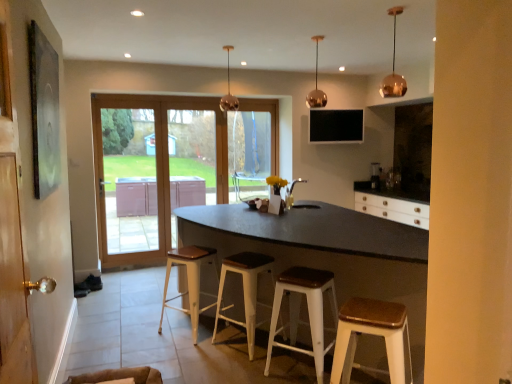
Find the location of a particular element. This screenshot has height=384, width=512. white wood stool at lower right, placed as the 1th stool when sorted from front to back is located at coordinates point(373,335).

Locate an element on the screen. The width and height of the screenshot is (512, 384). white metal stool at center, acting as the 2th stool starting from the front is located at coordinates (298, 311).

What do you see at coordinates (229, 91) in the screenshot?
I see `metallic gold pendant light at upper center, marked as the third light fixture in a right-to-left arrangement` at bounding box center [229, 91].

The height and width of the screenshot is (384, 512). Find the location of `matte silver sink at center`. matte silver sink at center is located at coordinates (293, 197).

What do you see at coordinates (326, 251) in the screenshot?
I see `black matte table at center` at bounding box center [326, 251].

In order to click on white wood stool at lower right, which ranks as the fourth stool in back-to-front order in this screenshot , I will do `click(373, 335)`.

Considering the points (375, 313) and (388, 10), which point is behind, point (375, 313) or point (388, 10)?

Positioned behind is point (388, 10).

From a real-world perspective, relative to copper metallic pendant light at upper right, marked as the 3th light fixture in a left-to-right arrangement, is white wood stool at lower right, which ranks as the fourth stool in back-to-front order, vertically above or below?

white wood stool at lower right, which ranks as the fourth stool in back-to-front order, is situated lower than copper metallic pendant light at upper right, marked as the 3th light fixture in a left-to-right arrangement, in the real world.

Which object is more forward, white wood stool at lower right, which ranks as the fourth stool in back-to-front order, or copper metallic pendant light at upper right, which appears as the 1th light fixture when viewed from the front?

white wood stool at lower right, which ranks as the fourth stool in back-to-front order, is more forward.

In the image, is white wood stool at lower right, which ranks as the fourth stool in back-to-front order, on the left side or the right side of copper metallic pendant light at upper right, marked as the 3th light fixture in a left-to-right arrangement?

In the image, white wood stool at lower right, which ranks as the fourth stool in back-to-front order, appears on the left side of copper metallic pendant light at upper right, marked as the 3th light fixture in a left-to-right arrangement.

Which of these two, transparent glass window at center or metallic silver blender at center, is thinner?

transparent glass window at center is thinner.

Is there a large distance between transparent glass window at center and metallic silver blender at center?

Yes, transparent glass window at center and metallic silver blender at center are quite far apart.

Is white wood stool at center, placed as the first stool when sorted from back to front, next to white metal stool at center, acting as the 2th stool starting from the front, and touching it?

white wood stool at center, placed as the first stool when sorted from back to front, and white metal stool at center, acting as the 2th stool starting from the front, are not in contact.

Considering the sizes of objects white wood stool at center, placed as the fourth stool when sorted from front to back, and white metal stool at center, the 3th stool from the back, in the image provided, who is taller, white wood stool at center, placed as the fourth stool when sorted from front to back, or white metal stool at center, the 3th stool from the back,?

Standing taller between the two is white wood stool at center, placed as the fourth stool when sorted from front to back.

Would you say white wood stool at center, placed as the first stool when sorted from back to front, contains white metal stool at center, acting as the 2th stool starting from the front?

No, white metal stool at center, acting as the 2th stool starting from the front, is not surrounded by white wood stool at center, placed as the first stool when sorted from back to front.

Between white wood stool at center, placed as the fourth stool when sorted from front to back, and white metal stool at center, the 3th stool from the back, which one has larger width?

Wider between the two is white wood stool at center, placed as the fourth stool when sorted from front to back.

Considering the sizes of objects metallic silver blender at center and transparent glass window at center in the image provided, who is shorter, metallic silver blender at center or transparent glass window at center?

metallic silver blender at center is shorter.

Is metallic silver blender at center bigger than transparent glass window at center?

No, metallic silver blender at center is not bigger than transparent glass window at center.

Does metallic silver blender at center come in front of transparent glass window at center?

That is False.

Is point (375, 174) closer or farther from the camera than point (248, 162)?

Clearly, point (375, 174) is more distant from the camera than point (248, 162).

Which of these two, copper metallic pendant light at upper right, the 3th light fixture viewed from the back, or white metal stool at center, acting as the 2th stool starting from the front, is bigger?

Bigger between the two is white metal stool at center, acting as the 2th stool starting from the front.

Between copper metallic pendant light at upper right, marked as the 3th light fixture in a left-to-right arrangement, and white metal stool at center, the 3th stool from the back, which one has smaller width?

Thinner between the two is copper metallic pendant light at upper right, marked as the 3th light fixture in a left-to-right arrangement.

Can you tell me how much copper metallic pendant light at upper right, positioned as the first light fixture in right-to-left order, and white metal stool at center, the 3th stool from the back, differ in facing direction?

The angular difference between copper metallic pendant light at upper right, positioned as the first light fixture in right-to-left order, and white metal stool at center, the 3th stool from the back, is 142 degrees.

Is copper metallic pendant light at upper right, marked as the 3th light fixture in a left-to-right arrangement, located outside white metal stool at center, the 3th stool from the back?

Yes.

From a real-world perspective, is copper metallic pendant light at upper right, marked as the 3th light fixture in a left-to-right arrangement, positioned above or below white wood stool at center, placed as the fourth stool when sorted from front to back?

copper metallic pendant light at upper right, marked as the 3th light fixture in a left-to-right arrangement, is situated higher than white wood stool at center, placed as the fourth stool when sorted from front to back, in the real world.

Is copper metallic pendant light at upper right, positioned as the first light fixture in right-to-left order, positioned far away from white wood stool at center, placed as the first stool when sorted from back to front?

That's right, there is a large distance between copper metallic pendant light at upper right, positioned as the first light fixture in right-to-left order, and white wood stool at center, placed as the first stool when sorted from back to front.

Is copper metallic pendant light at upper right, the 3th light fixture viewed from the back, wider or thinner than white wood stool at center, placed as the first stool when sorted from back to front?

Clearly, copper metallic pendant light at upper right, the 3th light fixture viewed from the back, has less width compared to white wood stool at center, placed as the first stool when sorted from back to front.

Considering the sizes of white wood stool at center, placed as the fourth stool when sorted from front to back, and white wood stool at lower right, placed as the 1th stool when sorted from front to back, in the image, is white wood stool at center, placed as the fourth stool when sorted from front to back, bigger or smaller than white wood stool at lower right, placed as the 1th stool when sorted from front to back,?

Clearly, white wood stool at center, placed as the fourth stool when sorted from front to back, is larger in size than white wood stool at lower right, placed as the 1th stool when sorted from front to back.

Between white wood stool at center, placed as the fourth stool when sorted from front to back, and white wood stool at lower right, which ranks as the fourth stool in back-to-front order, which one has smaller width?

white wood stool at lower right, which ranks as the fourth stool in back-to-front order.

Can you tell me how much white wood stool at center, placed as the fourth stool when sorted from front to back, and white wood stool at lower right, placed as the 1th stool when sorted from front to back, differ in facing direction?

white wood stool at center, placed as the fourth stool when sorted from front to back, and white wood stool at lower right, placed as the 1th stool when sorted from front to back, are facing 8.46 degrees away from each other.

Based on their positions, is white wood stool at center, placed as the first stool when sorted from back to front, located to the left or right of white wood stool at lower right, placed as the 1th stool when sorted from front to back?

white wood stool at center, placed as the first stool when sorted from back to front, is to the left of white wood stool at lower right, placed as the 1th stool when sorted from front to back.

This screenshot has width=512, height=384. What are the coordinates of `the 1st stool positioned below the copper metallic pendant light at upper right, which appears as the 1th light fixture when viewed from the front (from a real-world perspective)` in the screenshot? It's located at (373, 335).

At what (x,y) coordinates should I click in order to perform the action: click on window on the left side of metallic silver blender at center. Please return your answer as a coordinate pair (x, y). The height and width of the screenshot is (384, 512). Looking at the image, I should click on (249, 154).

From the image, which object appears to be farther from black matte table at center, white metal stool at center, acting as the 2th stool starting from the front, or matte silver sink at center?

Based on the image, matte silver sink at center appears to be further to black matte table at center.

Based on their spatial positions, is transparent glass window at center or gold metallic pendant light at upper center, the second light fixture positioned from the back, closer to metallic gold pendant light at upper center, which is the 3th light fixture in front-to-back order?

transparent glass window at center.

When comparing their distances from wooden door handle on the left, does gold metallic pendant light at upper center, which appears as the 2th light fixture when viewed from the left, or matte silver sink at center seem closer?

The object closer to wooden door handle on the left is matte silver sink at center.

Estimate the real-world distances between objects in this image. Which object is closer to white wood stool at lower right, placed as the 1th stool when sorted from front to back, black matte table at center or metallic gold pendant light at upper center, arranged as the first light fixture when viewed from the left?

black matte table at center is closer to white wood stool at lower right, placed as the 1th stool when sorted from front to back.

Which object lies nearer to the anchor point metallic silver blender at center, wooden door handle on the left or black matte table at center?

black matte table at center.

Considering their positions, is metallic gold pendant light at upper center, placed as the first light fixture when sorted from back to front, positioned further to white metal stool at center, the 3th stool from the back, than wooden door handle on the left?

metallic gold pendant light at upper center, placed as the first light fixture when sorted from back to front, lies further to white metal stool at center, the 3th stool from the back, than the other object.

Which object lies further to the anchor point wooden door handle on the left, matte silver sink at center or white wood stool at center, placed as the fourth stool when sorted from front to back?

matte silver sink at center is positioned further to the anchor wooden door handle on the left.

From the image, which object appears to be nearer to gold metallic pendant light at upper center, which appears as the second light fixture when viewed from the front, transparent glass window at center or wooden door handle on the left?

transparent glass window at center is closer to gold metallic pendant light at upper center, which appears as the second light fixture when viewed from the front.

The height and width of the screenshot is (384, 512). Find the location of `table between wooden door handle on the left and white wood stool at center, the 3th stool viewed from the front, along the z-axis`. table between wooden door handle on the left and white wood stool at center, the 3th stool viewed from the front, along the z-axis is located at coordinates (326, 251).

This screenshot has height=384, width=512. I want to click on table between wooden door handle on the left and gold metallic pendant light at upper center, which appears as the second light fixture when viewed from the front, from front to back, so click(x=326, y=251).

Find the location of a particular element. Image resolution: width=512 pixels, height=384 pixels. window located between white wood stool at center, placed as the first stool when sorted from back to front, and metallic silver blender at center in the depth direction is located at coordinates (249, 154).

The image size is (512, 384). I want to click on light fixture between gold metallic pendant light at upper center, arranged as the 2th light fixture when viewed from the right, and black matte table at center vertically, so click(x=394, y=67).